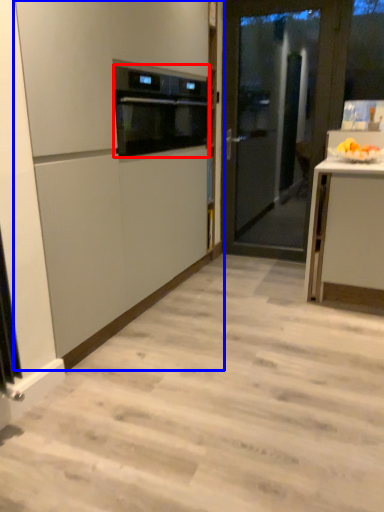
Question: Which of the following is the farthest to the observer, kitchen appliance (highlighted by a red box) or cabinetry (highlighted by a blue box)?

Choices:
 (A) kitchen appliance
 (B) cabinetry

Answer: (A)